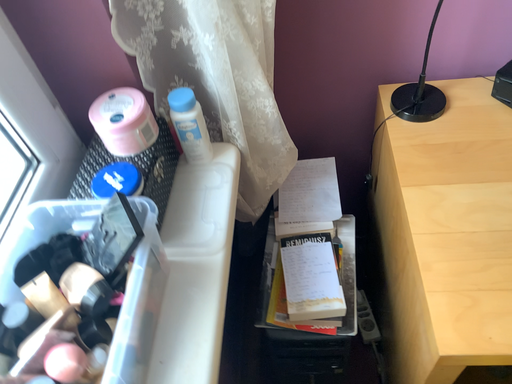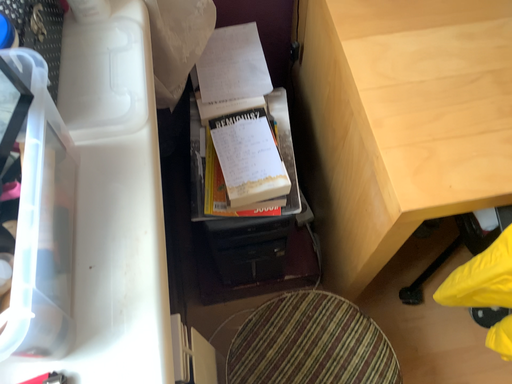
Question: How did the camera likely rotate when shooting the video?

Choices:
 (A) rotated left
 (B) rotated right

Answer: (B)